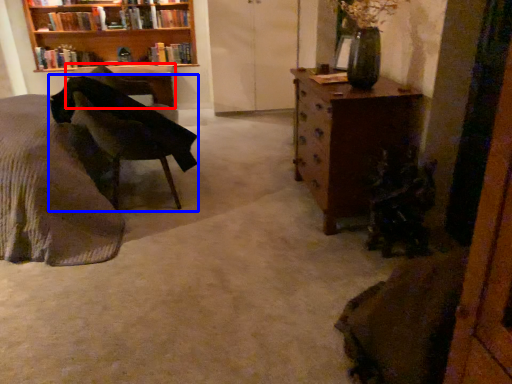
Question: Which object is further to the camera taking this photo, desk (highlighted by a red box) or chair (highlighted by a blue box)?

Choices:
 (A) desk
 (B) chair

Answer: (A)